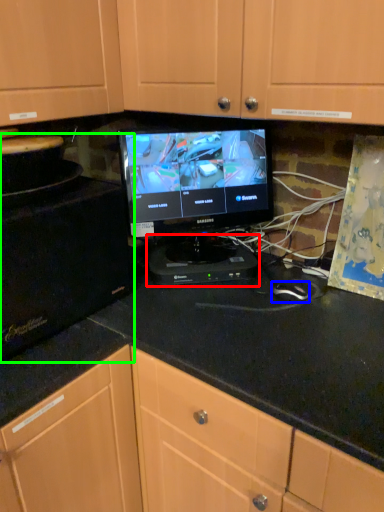
Question: Which object is the farthest from appliance (highlighted by a red box)? Choose among these: mouse (highlighted by a blue box) or appliance (highlighted by a green box).

Choices:
 (A) mouse
 (B) appliance

Answer: (B)